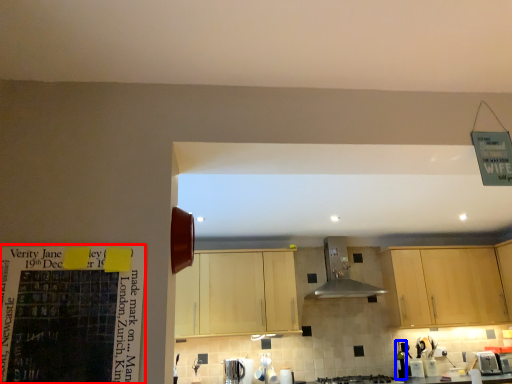
Question: Which of the following is the farthest to the observer, bulletin board (highlighted by a red box) or bottle (highlighted by a blue box)?

Choices:
 (A) bulletin board
 (B) bottle

Answer: (B)